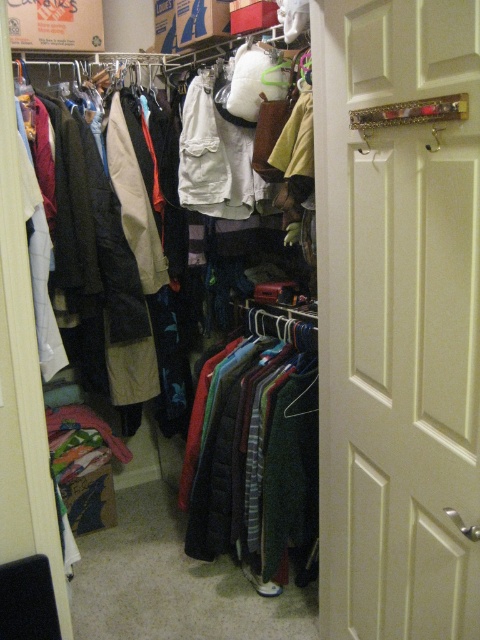
Which is more to the right, white wood door at center or dark green wool sweater at center?

Positioned to the right is white wood door at center.

Where is `white wood door at center`? white wood door at center is located at coordinates (397, 316).

Between point (195, 588) and point (271, 330), which one is positioned behind?

The point (195, 588) is behind.

Is point (24, 340) farther from camera compared to point (228, 362)?

No.

Locate an element on the screen. This screenshot has height=640, width=480. matte black coat at upper left is located at coordinates (169, 570).

Is white wood door at center above matte black coat at upper left?

Yes.

Is white wood door at center to the left of matte black coat at upper left from the viewer's perspective?

Incorrect, white wood door at center is not on the left side of matte black coat at upper left.

At what (x,y) coordinates should I click in order to perform the action: click on white wood door at center. Please return your answer as a coordinate pair (x, y). The height and width of the screenshot is (640, 480). Looking at the image, I should click on (397, 316).